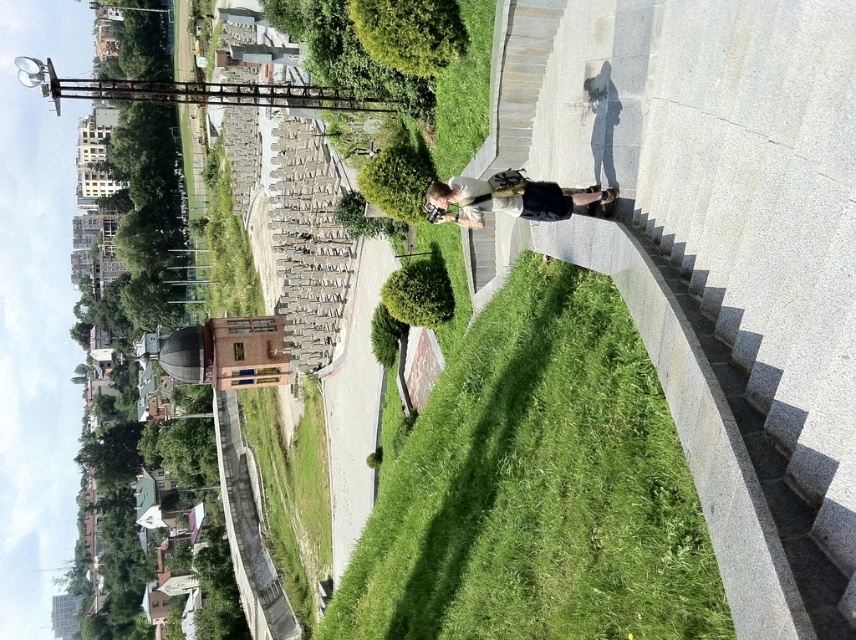
The width and height of the screenshot is (856, 640). Describe the element at coordinates (538, 488) in the screenshot. I see `green grassy at center` at that location.

Which of these two, green grassy at center or light beige fabric jacket at center, stands taller?

green grassy at center is taller.

Identify the location of green grassy at center. (538, 488).